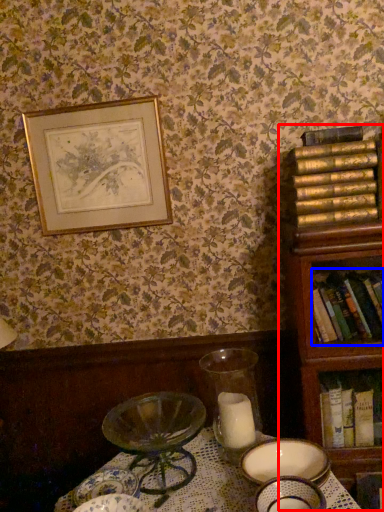
Question: Which object is further to the camera taking this photo, bookcase (highlighted by a red box) or book (highlighted by a blue box)?

Choices:
 (A) bookcase
 (B) book

Answer: (B)